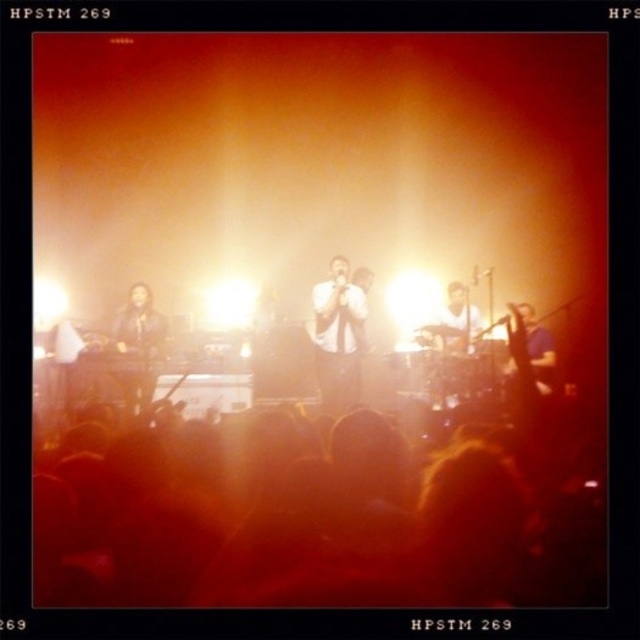
Which is behind, point (316, 346) or point (522, 301)?

The point (522, 301) is behind.

How much distance is there between white glossy shirt at center and blue fabric shirt at right?

A distance of 1.52 meters exists between white glossy shirt at center and blue fabric shirt at right.

Does point (317, 378) come closer to viewer compared to point (504, 369)?

Yes, point (317, 378) is closer to viewer.

Identify the location of white glossy shirt at center. The height and width of the screenshot is (640, 640). (339, 336).

How far apart are white glossy shirt at center and shiny black jacket at left?

The distance of white glossy shirt at center from shiny black jacket at left is 1.51 meters.

Does white glossy shirt at center appear on the right side of shiny black jacket at left?

Correct, you'll find white glossy shirt at center to the right of shiny black jacket at left.

Is point (348, 289) farther from camera compared to point (116, 323)?

No.

The image size is (640, 640). In order to click on white glossy shirt at center in this screenshot , I will do tap(339, 336).

This screenshot has width=640, height=640. I want to click on white glossy shirt at center, so click(x=339, y=336).

Can you confirm if white glossy shirt at center is bigger than white matte shirt at center?

Incorrect, white glossy shirt at center is not larger than white matte shirt at center.

Find the location of a particular element. white glossy shirt at center is located at coordinates (339, 336).